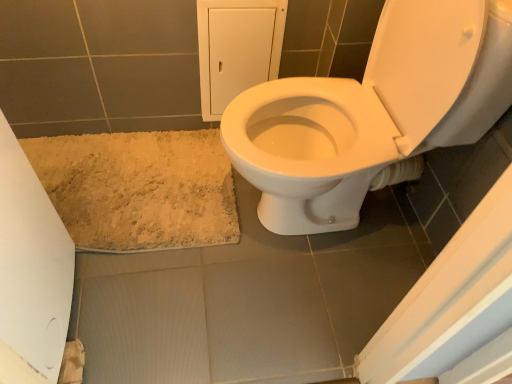
Question: Can you see beige shaggy bath mat at lower left touching white paper at lower left?

Choices:
 (A) no
 (B) yes

Answer: (A)

Question: Can you confirm if beige shaggy bath mat at lower left is thinner than white paper at lower left?

Choices:
 (A) yes
 (B) no

Answer: (B)

Question: From the image's perspective, is beige shaggy bath mat at lower left above white paper at lower left?

Choices:
 (A) yes
 (B) no

Answer: (A)

Question: Is beige shaggy bath mat at lower left further to camera compared to white paper at lower left?

Choices:
 (A) yes
 (B) no

Answer: (A)

Question: Is beige shaggy bath mat at lower left outside white paper at lower left?

Choices:
 (A) yes
 (B) no

Answer: (A)

Question: Does point (57, 382) appear closer or farther from the camera than point (233, 236)?

Choices:
 (A) closer
 (B) farther

Answer: (A)

Question: From a real-world perspective, is white paper at lower left physically located above or below beige shaggy bath mat at lower left?

Choices:
 (A) above
 (B) below

Answer: (B)

Question: Based on their sizes in the image, would you say white paper at lower left is bigger or smaller than beige shaggy bath mat at lower left?

Choices:
 (A) big
 (B) small

Answer: (B)

Question: In terms of width, does white paper at lower left look wider or thinner when compared to beige shaggy bath mat at lower left?

Choices:
 (A) wide
 (B) thin

Answer: (B)

Question: Looking at the image, does white glossy toilet at center seem bigger or smaller compared to white paper at lower left?

Choices:
 (A) small
 (B) big

Answer: (B)

Question: From a real-world perspective, is white glossy toilet at center physically located above or below white paper at lower left?

Choices:
 (A) below
 (B) above

Answer: (B)

Question: Is white glossy toilet at center wider or thinner than white paper at lower left?

Choices:
 (A) thin
 (B) wide

Answer: (B)

Question: Do you think white glossy toilet at center is within white paper at lower left, or outside of it?

Choices:
 (A) outside
 (B) inside

Answer: (A)

Question: Is point (181, 137) closer or farther from the camera than point (225, 130)?

Choices:
 (A) closer
 (B) farther

Answer: (B)

Question: Would you say beige shaggy bath mat at lower left is inside or outside white glossy toilet at center?

Choices:
 (A) outside
 (B) inside

Answer: (A)